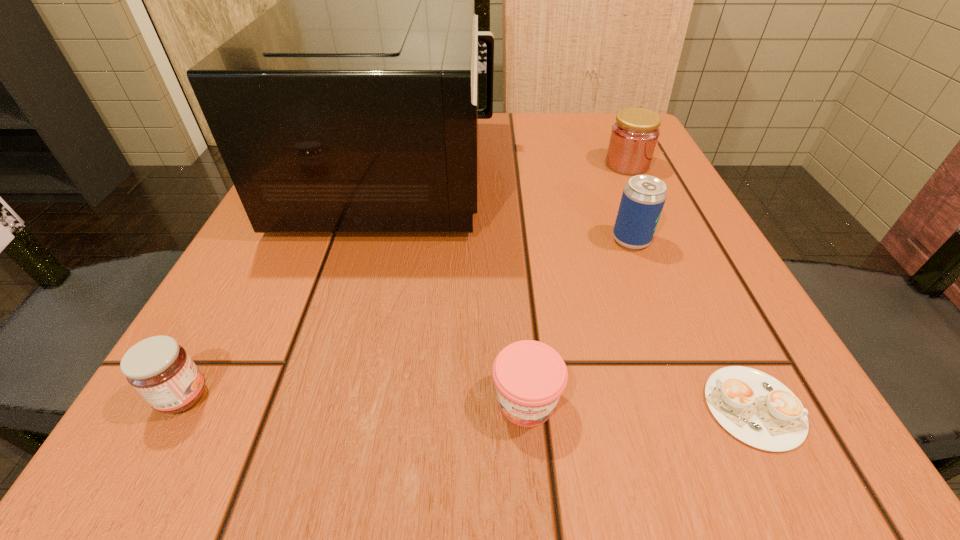
You are a GUI agent. You are given a task and a screenshot of the screen. Output one action in this format:
    pyautogui.click(x=<x>, y=<y>)
    Task: Click on the vacant point located 0.310m on the left of the beer can
    
    Given the screenshot: What is the action you would take?
    coord(420,240)

I want to click on free location located on the left of the tallest jam, so click(420, 164).

In order to click on free point located on the back of the fourth tallest object in this screenshot , I will do `click(296, 191)`.

What are the coordinates of `free location located 0.280m on the back of the shortest object` in the screenshot? It's located at point(665,227).

Find the location of a particular element. The width and height of the screenshot is (960, 540). microwave_oven present at the far edge is located at coordinates (350, 106).

Locate an element on the screen. The image size is (960, 540). jam present at the far edge is located at coordinates (634, 136).

Identify the location of cappuccino that is positioned at the near edge. (756, 408).

Image resolution: width=960 pixels, height=540 pixels. Find the location of `microwave_oven located at the left edge`. microwave_oven located at the left edge is located at coordinates (350, 106).

Locate an element on the screen. This screenshot has width=960, height=540. jam that is at the left edge is located at coordinates (158, 368).

Identify the location of beer can that is at the right edge. (643, 198).